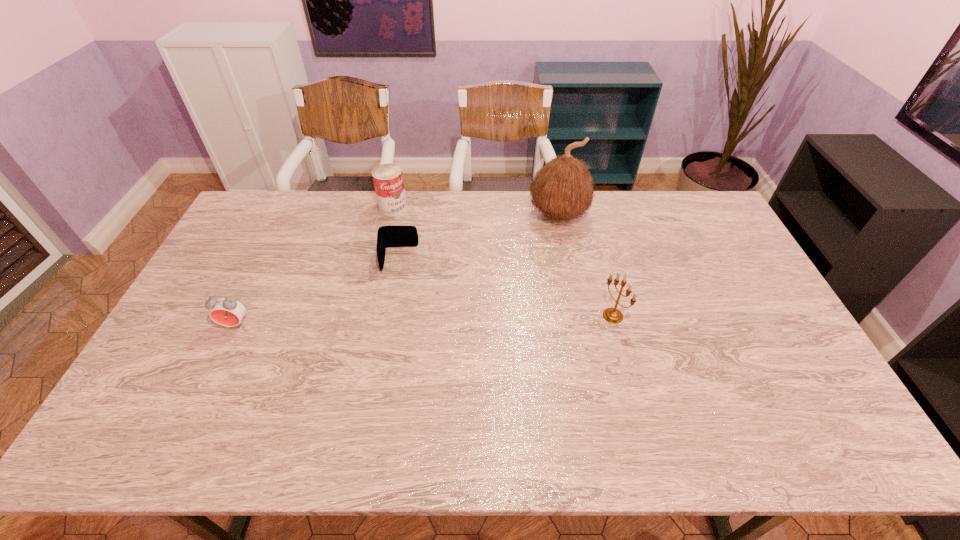
The width and height of the screenshot is (960, 540). What are the coordinates of `vacant area that lies between the shortest object and the tallest object` in the screenshot? It's located at (479, 237).

Where is `vacant area that lies between the candelabrum and the can`? The width and height of the screenshot is (960, 540). vacant area that lies between the candelabrum and the can is located at coordinates (503, 261).

In order to click on vacant space that is in between the candelabrum and the can in this screenshot , I will do `click(503, 261)`.

The image size is (960, 540). In order to click on vacant space that's between the candelabrum and the coconut in this screenshot , I will do `click(586, 266)`.

At what (x,y) coordinates should I click in order to perform the action: click on vacant region between the third shortest object and the leftmost object. Please return your answer as a coordinate pair (x, y). Looking at the image, I should click on (314, 266).

Select which object appears as the fourth closest to the tallest object. Please provide its 2D coordinates. Your answer should be formatted as a tuple, i.e. [(x, y)], where the tuple contains the x and y coordinates of a point satisfying the conditions above.

[(226, 311)]

Locate which object is the fourth closest to the second shortest object. Please provide its 2D coordinates. Your answer should be formatted as a tuple, i.e. [(x, y)], where the tuple contains the x and y coordinates of a point satisfying the conditions above.

[(613, 315)]